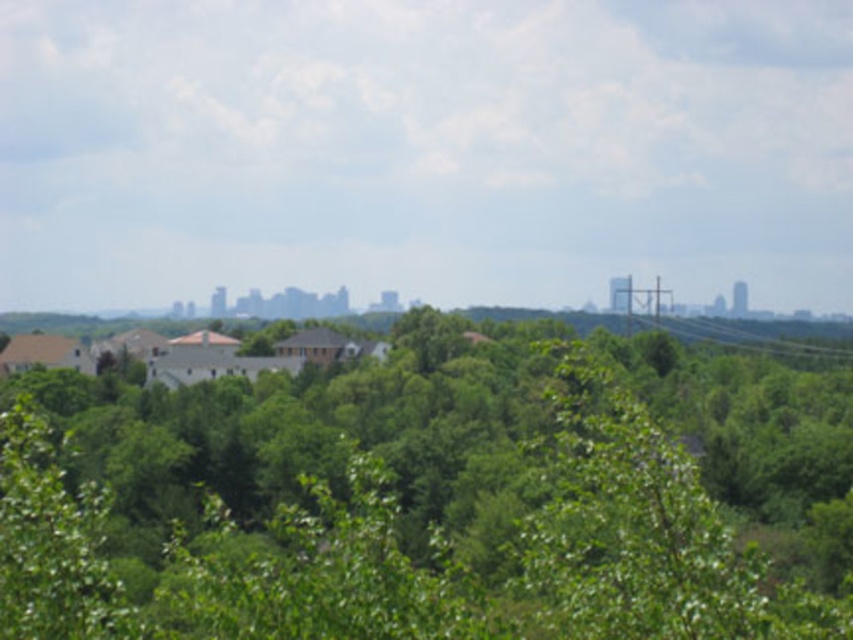
Looking at this image, you are a bird looking for a place to perch. You see a green leafy tree at center and a metallic wire at right. Which option would be a better choice for a tall perch?

The green leafy tree at center is much taller than the metallic wire at right, so it would be a better choice for a tall perch.

You are standing in the suburban area looking at the image. There are two points marked in the scene, point 1 at coordinates point 1 at point (364, 624) and point 2 at point (758, 348). If you want to walk from point 1 to point 2, which direction should you move relative to your current position?

You should move backward because point 1 at point (364, 624) is in front of point 2 at point (758, 348), so to reach point 2 from point 1, you need to move in the opposite direction away from the foreground towards the background.